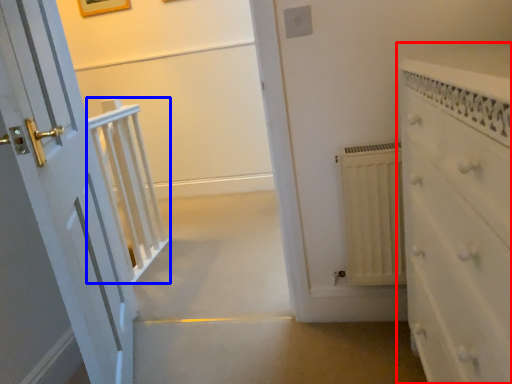
Question: Which object appears closest to the camera in this image, chest of drawers (highlighted by a red box) or balustrade (highlighted by a blue box)?

Choices:
 (A) chest of drawers
 (B) balustrade

Answer: (A)